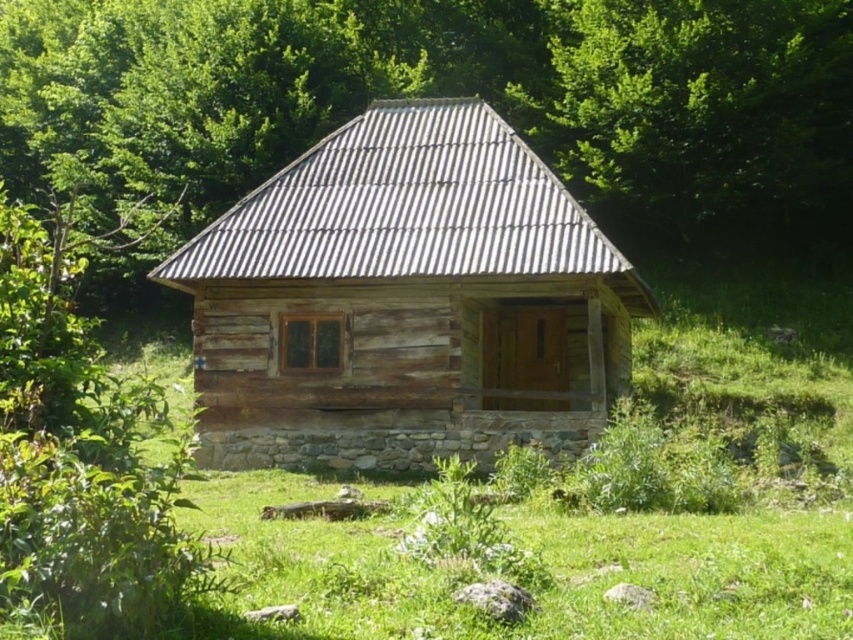
Locate an element on the screen. The image size is (853, 640). green leafy tree at upper center is located at coordinates (444, 93).

In the scene shown: Which is below, green leafy tree at upper center or weathered wood log cabin at center?

weathered wood log cabin at center is lower down.

What are the coordinates of `green leafy tree at upper center` in the screenshot? It's located at (444, 93).